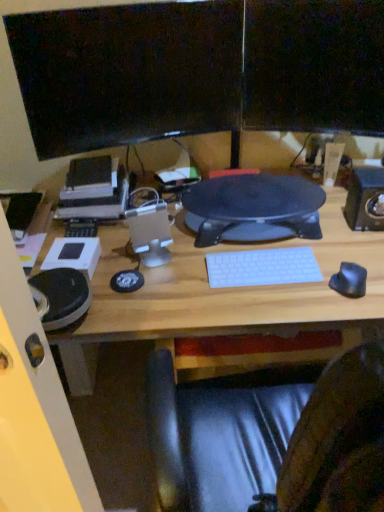
Question: Does white plastic keyboard at center have a greater width compared to matte black monitor at upper center, the second computer monitor when ordered from left to right?

Choices:
 (A) yes
 (B) no

Answer: (A)

Question: Is white plastic keyboard at center to the right of matte black monitor at upper center, the 1th computer monitor in the right-to-left sequence, from the viewer's perspective?

Choices:
 (A) yes
 (B) no

Answer: (B)

Question: From a real-world perspective, is white plastic keyboard at center over matte black monitor at upper center, the second computer monitor when ordered from left to right?

Choices:
 (A) yes
 (B) no

Answer: (B)

Question: Would you say white plastic keyboard at center contains matte black monitor at upper center, the 1th computer monitor in the right-to-left sequence?

Choices:
 (A) yes
 (B) no

Answer: (B)

Question: From the image's perspective, would you say white plastic keyboard at center is shown under matte black monitor at upper center, the second computer monitor when ordered from left to right?

Choices:
 (A) yes
 (B) no

Answer: (A)

Question: From the image's perspective, is black glossy monitor at upper center, the second computer monitor when ordered from right to left, located above or below black textured mouse pad at center?

Choices:
 (A) below
 (B) above

Answer: (B)

Question: Considering their positions, is black glossy monitor at upper center, the second computer monitor when ordered from right to left, located in front of or behind black textured mouse pad at center?

Choices:
 (A) front
 (B) behind

Answer: (A)

Question: Based on their sizes in the image, would you say black glossy monitor at upper center, which is the first computer monitor from left to right, is bigger or smaller than black textured mouse pad at center?

Choices:
 (A) small
 (B) big

Answer: (A)

Question: Is black glossy monitor at upper center, the second computer monitor when ordered from right to left, wider or thinner than black textured mouse pad at center?

Choices:
 (A) wide
 (B) thin

Answer: (B)

Question: Based on their positions, is matte black monitor at upper center, the 1th computer monitor in the right-to-left sequence, located to the left or right of black glossy monitor at upper center, the second computer monitor when ordered from right to left?

Choices:
 (A) left
 (B) right

Answer: (B)

Question: From the image's perspective, is matte black monitor at upper center, the second computer monitor when ordered from left to right, above or below black glossy monitor at upper center, which is the first computer monitor from left to right?

Choices:
 (A) below
 (B) above

Answer: (B)

Question: Would you say matte black monitor at upper center, the 1th computer monitor in the right-to-left sequence, is inside or outside black glossy monitor at upper center, which is the first computer monitor from left to right?

Choices:
 (A) outside
 (B) inside

Answer: (A)

Question: Is matte black monitor at upper center, the second computer monitor when ordered from left to right, wider or thinner than black glossy monitor at upper center, the second computer monitor when ordered from right to left?

Choices:
 (A) wide
 (B) thin

Answer: (A)

Question: Is white plastic keyboard at center inside or outside of black plastic speaker at right, the 1th speaker from the right?

Choices:
 (A) inside
 (B) outside

Answer: (B)

Question: Considering the positions of point (288, 271) and point (360, 211), is point (288, 271) closer or farther from the camera than point (360, 211)?

Choices:
 (A) farther
 (B) closer

Answer: (B)